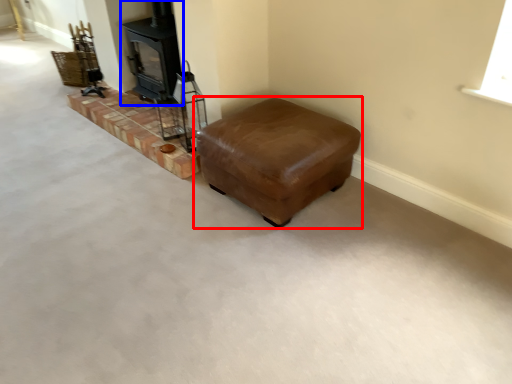
Question: Which of the following is the farthest to the observer, furniture (highlighted by a red box) or wood burning stove (highlighted by a blue box)?

Choices:
 (A) furniture
 (B) wood burning stove

Answer: (B)